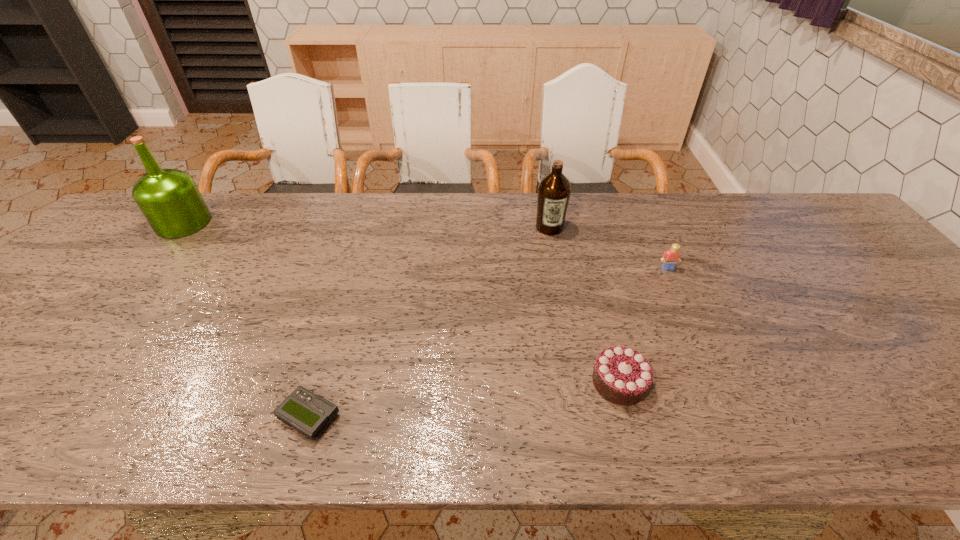
Where is `free spot at the left edge of the desktop`? This screenshot has width=960, height=540. free spot at the left edge of the desktop is located at coordinates (30, 355).

Where is `free region at the right edge of the desktop`? free region at the right edge of the desktop is located at coordinates (903, 338).

The image size is (960, 540). Find the location of `vacant space in between the chocolate cake and the shortest object`. vacant space in between the chocolate cake and the shortest object is located at coordinates (465, 400).

The height and width of the screenshot is (540, 960). What are the coordinates of `free area in between the rightmost object and the chocolate cake` in the screenshot? It's located at (643, 325).

At what (x,y) coordinates should I click in order to perform the action: click on free space between the chocolate cake and the Lego. Please return your answer as a coordinate pair (x, y). Image resolution: width=960 pixels, height=540 pixels. Looking at the image, I should click on (643, 325).

Where is `free spot between the third nearest object and the fourth shortest object`? free spot between the third nearest object and the fourth shortest object is located at coordinates (609, 248).

Where is `vacant area between the chocolate cake and the left olive oil`? vacant area between the chocolate cake and the left olive oil is located at coordinates (401, 302).

The height and width of the screenshot is (540, 960). Identify the location of free space between the Lego and the right olive oil. (609, 248).

Find the location of a particular element. empty space that is in between the shortest object and the third nearest object is located at coordinates (489, 343).

You are a GUI agent. You are given a task and a screenshot of the screen. Output one action in this format:
    pyautogui.click(x=<x>, y=<y>)
    Task: Click on the vacant space that's between the rightmost object and the second tallest object
    The width and height of the screenshot is (960, 540).
    Given the screenshot: What is the action you would take?
    pyautogui.click(x=609, y=248)